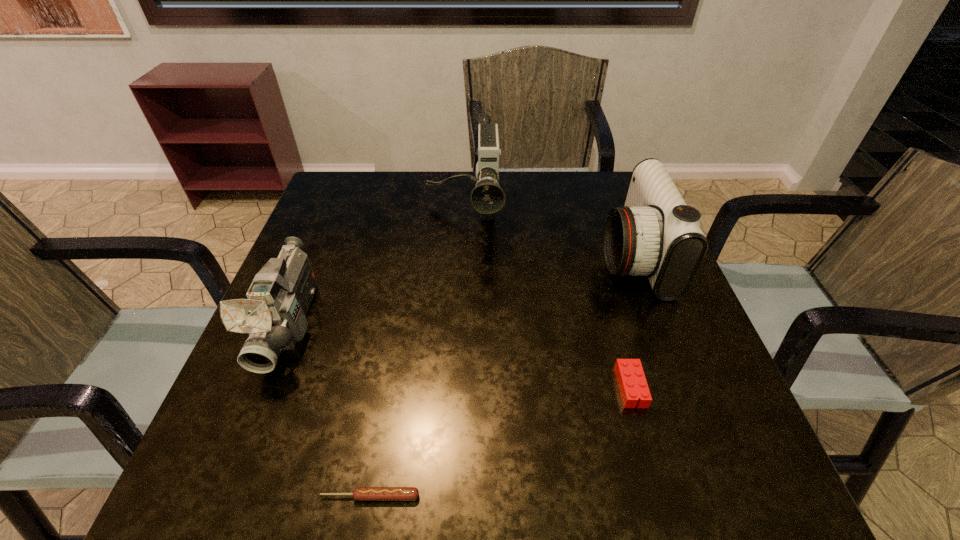
At what (x,y) coordinates should I click in order to perform the action: click on the second camcorder from right to left. Please return your answer as a coordinate pair (x, y). The width and height of the screenshot is (960, 540). Looking at the image, I should click on (487, 198).

You are a GUI agent. You are given a task and a screenshot of the screen. Output one action in this format:
    pyautogui.click(x=<x>, y=<y>)
    Task: Click on the rightmost camcorder
    The image size is (960, 540).
    Given the screenshot: What is the action you would take?
    pyautogui.click(x=656, y=234)

Where is `the leftmost object`? Image resolution: width=960 pixels, height=540 pixels. the leftmost object is located at coordinates (274, 315).

Locate an element on the screen. Image resolution: width=960 pixels, height=540 pixels. Lego is located at coordinates (632, 383).

The image size is (960, 540). What are the coordinates of `sausage` in the screenshot? It's located at (360, 493).

At what (x,y) coordinates should I click in order to perform the action: click on the shortest object. Please return your answer as a coordinate pair (x, y). The image size is (960, 540). Looking at the image, I should click on (360, 493).

What are the coordinates of `vacant space located on the recording direction of the second camcorder from right to left` in the screenshot? It's located at (457, 329).

Find the location of a particular element. The width and height of the screenshot is (960, 540). vacant area situated 0.280m on the surface of the rightmost camcorder is located at coordinates (482, 256).

Find the location of a particular element. The width and height of the screenshot is (960, 540). vacant point located 0.170m on the surface of the rightmost camcorder is located at coordinates (528, 256).

This screenshot has width=960, height=540. Identify the location of vacant area situated 0.390m on the surface of the rightmost camcorder. (435, 256).